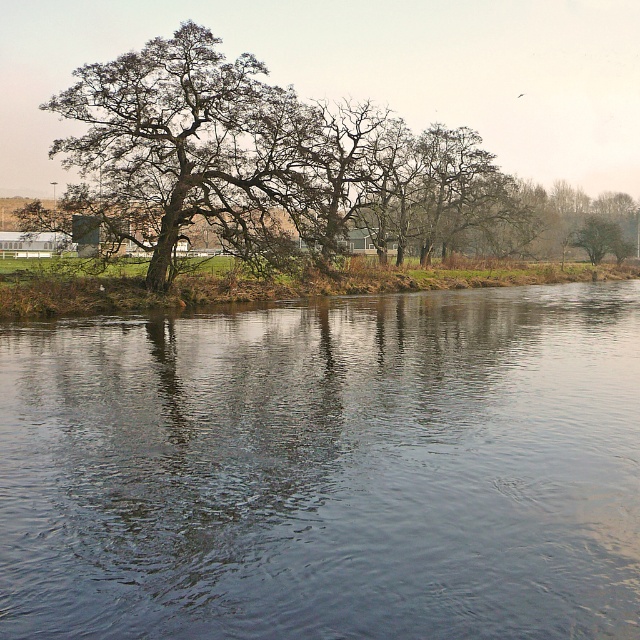
Question: Which of these objects is positioned farthest from the smooth brown tree at right?

Choices:
 (A) brown textured tree at center
 (B) dark blue water at center

Answer: (B)

Question: Is dark blue water at center thinner than smooth brown tree at right?

Choices:
 (A) yes
 (B) no

Answer: (B)

Question: Among these points, which one is nearest to the camera?

Choices:
 (A) (195, 392)
 (B) (593, 227)
 (C) (536, 102)
 (D) (179, 168)

Answer: (A)

Question: Does dark blue water at center appear on the left side of brown textured tree at center?

Choices:
 (A) yes
 (B) no

Answer: (A)

Question: Does brown textured tree at center have a lesser width compared to smooth brown tree at right?

Choices:
 (A) yes
 (B) no

Answer: (B)

Question: Among these objects, which one is farthest from the camera?

Choices:
 (A) brown textured tree at center
 (B) dark green textured oak tree at center
 (C) dark blue water at center
 (D) smooth brown tree at right

Answer: (D)